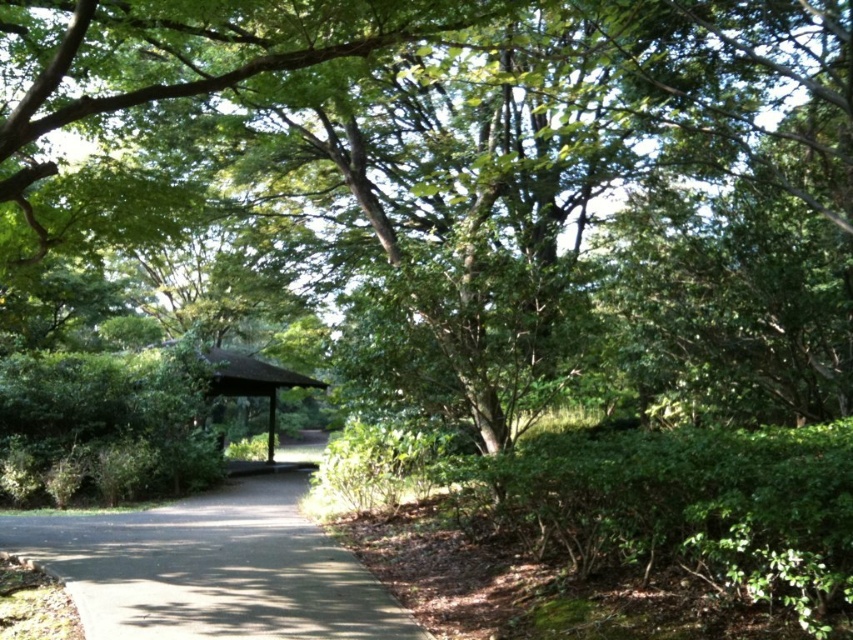
Which is behind, point (241, 627) or point (234, 385)?

The point (234, 385) is more distant.

Does point (224, 529) come farther from viewer compared to point (268, 442)?

No.

Identify the location of dark gray asphalt at center. (212, 570).